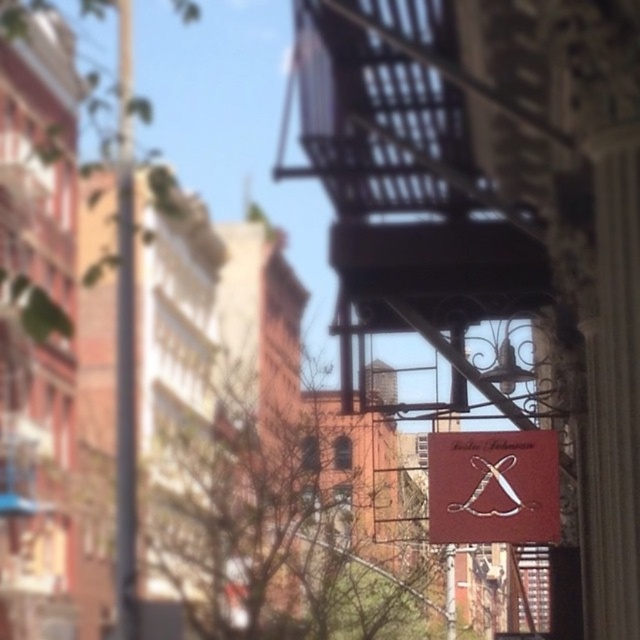
You are a delivery person trying to navigate through the street. You see the maroon leather sign at center and the metallic pole at left. Which object is wider?

The maroon leather sign at center is wider than the metallic pole at left.

You are a city planner assessing the street layout. You need to determine if the maroon leather sign at center can be seen from the top of the metallic pole at left. Based on their heights, can the sign be viewed from the pole?

The maroon leather sign at center has a lesser height compared to metallic pole at left, so it is possible to see the maroon leather sign at center from the top of the metallic pole at left since the pole is taller.